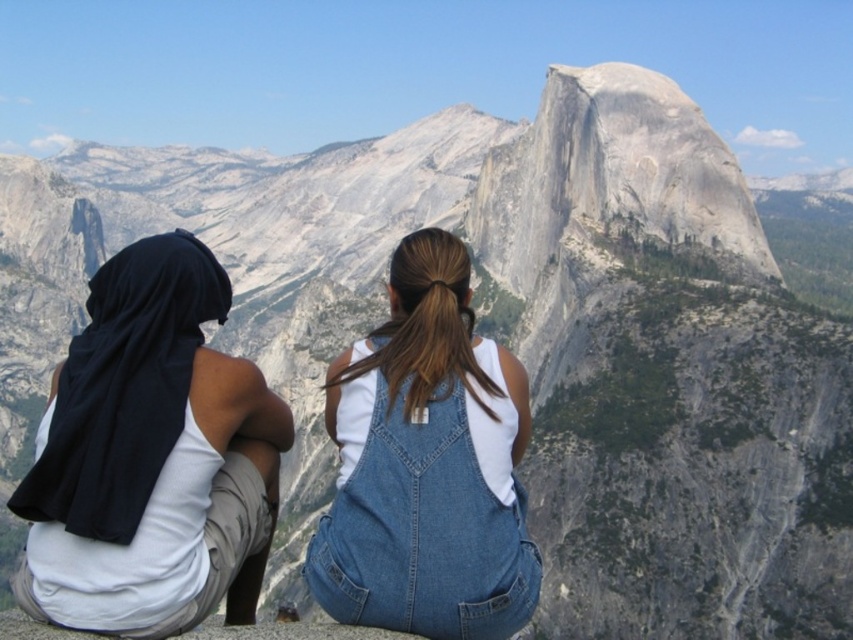
You are a photographer trying to capture both the white cotton tank top at left and the denim overalls at center in a single frame. Which clothing item will appear smaller in the photo?

The white cotton tank top at left will appear smaller in the photo because it is not as tall as the denim overalls at center, meaning it is closer to the camera and thus appears larger. Wait, no, actually, if the tank top is not as tall as the denim overalls, that means the denim overalls are taller. So, if the question is about which appears smaller, since the tank top is shorter in height, it would naturally look smaller. But the spatial description might involve distance. Hmm, need to clarify based on

You are a photographer trying to capture the scene of two people enjoying the mountain view. You want to ensure that both the white cotton tank top at left and the denim overalls at center are clearly visible in the photo. Based on their positions, which clothing item is higher up in the frame?

The white cotton tank top at left is located above the denim overalls at center, so it will appear higher up in the frame.

You are a photographer trying to capture both the white cotton tank top at left and the denim overalls at center in a single shot. Since you want to ensure both are in focus, which one should you focus on first to maximize clarity for both?

You should focus on the white cotton tank top at left first because it is closer to the viewer than the denim overalls at center. By focusing on the closer object, the farther one will still be within the depth of field, ensuring both are in focus.